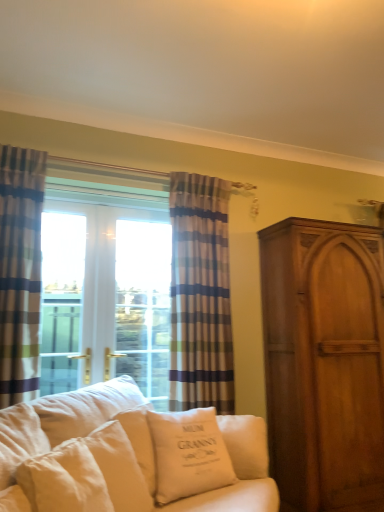
Question: Is point (198, 404) closer or farther from the camera than point (206, 434)?

Choices:
 (A) farther
 (B) closer

Answer: (A)

Question: From the image's perspective, is striped fabric curtain at center, which is counted as the second curtain, starting from the left, above or below white fabric couch at lower left?

Choices:
 (A) above
 (B) below

Answer: (A)

Question: Estimate the real-world distances between objects in this image. Which object is farther from the white cotton pillow at center, placed as the second pillow when sorted from right to left?

Choices:
 (A) striped fabric curtain at center, which is the second curtain from front to back
 (B) white fabric couch at lower left
 (C) matte wood cabinet at right
 (D) white cotton cushion at center, acting as the 2th pillow starting from the left
 (E) striped fabric curtain at left, positioned as the 1th curtain in left-to-right order

Answer: (C)

Question: Which object is the farthest from the matte wood cabinet at right?

Choices:
 (A) white cotton cushion at center, acting as the 2th pillow starting from the left
 (B) white fabric couch at lower left
 (C) striped fabric curtain at left, marked as the first curtain in a front-to-back arrangement
 (D) white cotton pillow at center, placed as the second pillow when sorted from right to left
 (E) striped fabric curtain at center, the first curtain positioned from the right

Answer: (C)